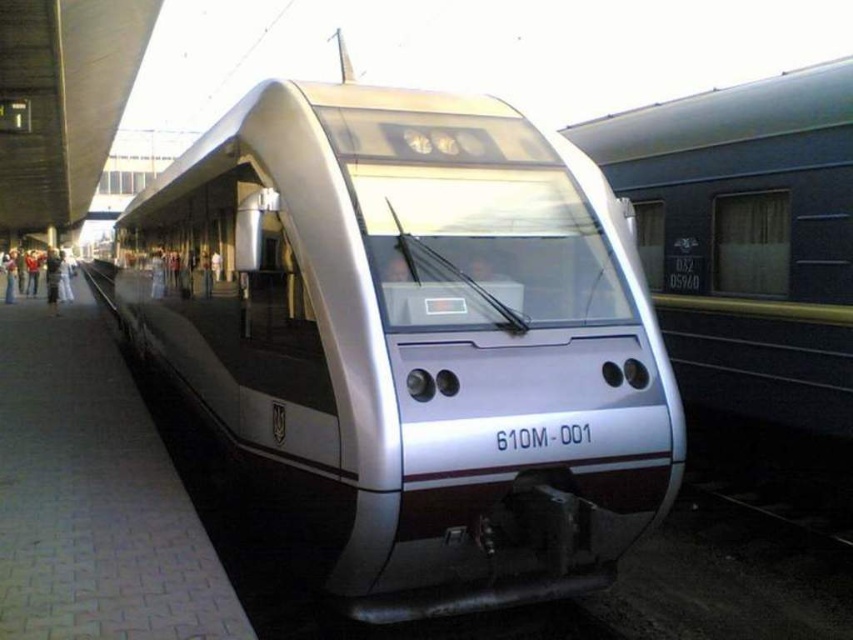
In the scene shown: Can you confirm if silver metallic train at center is smaller than gray concrete platform at center?

Incorrect, silver metallic train at center is not smaller in size than gray concrete platform at center.

Is silver metallic train at center above gray concrete platform at center?

Correct, silver metallic train at center is located above gray concrete platform at center.

Who is more forward, (525, 544) or (68, 438)?

Point (525, 544)

Find the location of a particular element. silver metallic train at center is located at coordinates (415, 337).

Is metallic silver train at center taller than gray concrete platform at center?

Correct, metallic silver train at center is much taller as gray concrete platform at center.

Which is behind, point (656, 234) or point (28, 321)?

Positioned behind is point (28, 321).

Is point (840, 326) farther from viewer compared to point (27, 419)?

No, (840, 326) is closer to viewer.

This screenshot has height=640, width=853. What are the coordinates of `metallic silver train at center` in the screenshot? It's located at (746, 237).

Between silver metallic train at center and metallic silver train at center, which one appears on the right side from the viewer's perspective?

metallic silver train at center is more to the right.

Is silver metallic train at center further to camera compared to metallic silver train at center?

No, it is not.

Who is more forward, (x=154, y=225) or (x=738, y=180)?

Point (x=738, y=180) is in front.

Where is `silver metallic train at center`? Image resolution: width=853 pixels, height=640 pixels. silver metallic train at center is located at coordinates (415, 337).